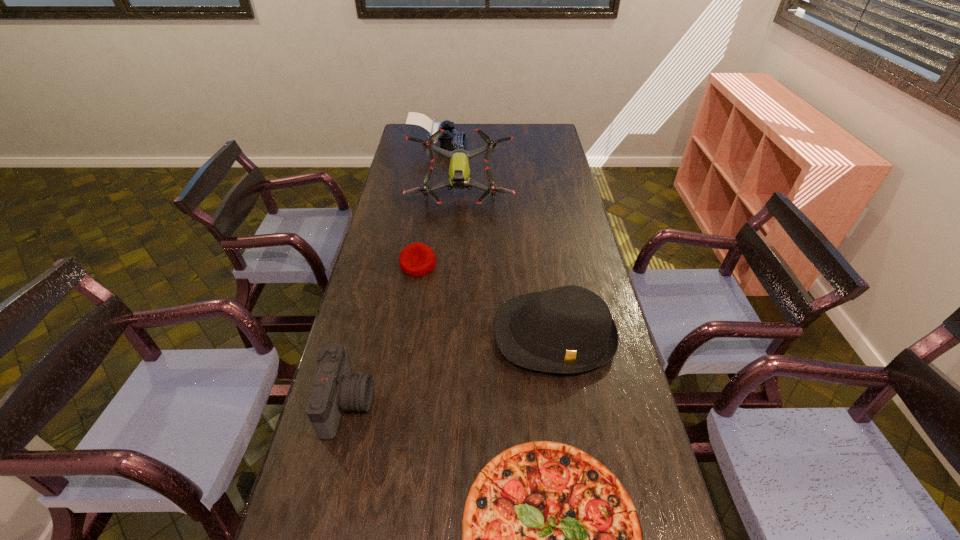
Find the location of a particular element. vacant space located 0.370m at the lens of the camera is located at coordinates (512, 404).

Identify the location of vacant space located 0.400m on the seat area of the fifth tallest object. (401, 375).

I want to click on object present at the far edge, so click(x=449, y=140).

Where is `drone at the left edge`? Image resolution: width=960 pixels, height=540 pixels. drone at the left edge is located at coordinates (459, 171).

Locate an element on the screen. typewriter at the left edge is located at coordinates (449, 140).

Locate an element on the screen. Image resolution: width=960 pixels, height=540 pixels. camera that is at the left edge is located at coordinates (335, 389).

Locate an element on the screen. beanbag situated at the left edge is located at coordinates (417, 259).

Find the location of a particular element. This screenshot has width=960, height=540. object located in the right edge section of the desktop is located at coordinates (569, 329).

This screenshot has width=960, height=540. In order to click on object that is at the far left corner in this screenshot , I will do `click(449, 140)`.

In the image, there is a desktop. At what (x,y) coordinates should I click in order to perform the action: click on free space at the far edge. Please return your answer as a coordinate pair (x, y). The image size is (960, 540). Looking at the image, I should click on (525, 139).